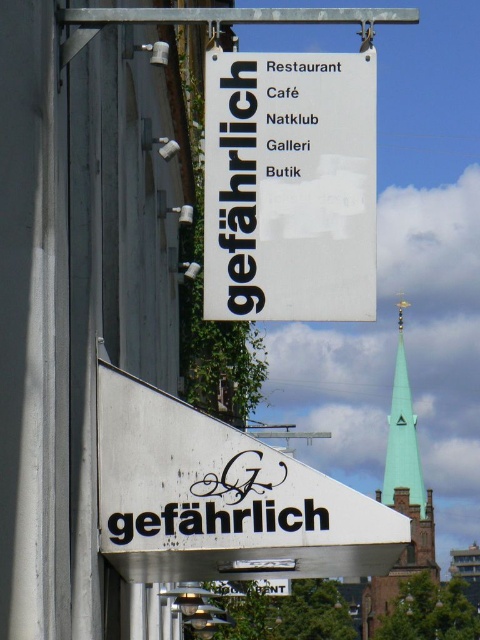
You are standing in front of the building and notice two green glass spires. Which one is closer to you, the green glass spire at right or the green glass spire at upper center?

The green glass spire at right is closer to you because it is in front of the green glass spire at upper center.